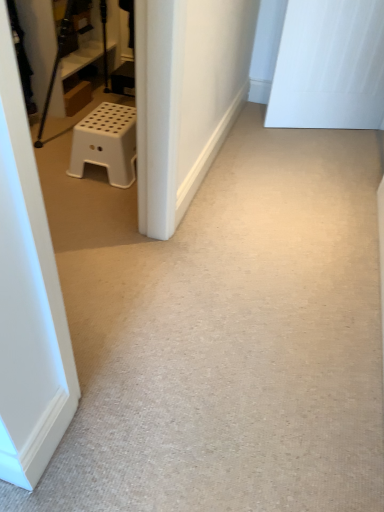
Question: Is white plastic stool at left further to camera compared to white matte door at upper right?

Choices:
 (A) yes
 (B) no

Answer: (B)

Question: Is white plastic stool at left closer to the viewer compared to white matte door at upper right?

Choices:
 (A) yes
 (B) no

Answer: (A)

Question: Considering the relative sizes of white plastic stool at left and white matte door at upper right in the image provided, is white plastic stool at left shorter than white matte door at upper right?

Choices:
 (A) no
 (B) yes

Answer: (B)

Question: Is white plastic stool at left beside white matte door at upper right?

Choices:
 (A) yes
 (B) no

Answer: (B)

Question: Does white plastic stool at left appear on the left side of white matte door at upper right?

Choices:
 (A) no
 (B) yes

Answer: (B)

Question: Is white plastic stool at left wider than white matte door at upper right?

Choices:
 (A) yes
 (B) no

Answer: (A)

Question: Is white matte door at upper right not close to white plastic stool at left?

Choices:
 (A) yes
 (B) no

Answer: (A)

Question: Is white matte door at upper right positioned beyond the bounds of white plastic stool at left?

Choices:
 (A) yes
 (B) no

Answer: (A)

Question: Does white matte door at upper right come behind white plastic stool at left?

Choices:
 (A) yes
 (B) no

Answer: (A)

Question: Is white matte door at upper right positioned with its back to white plastic stool at left?

Choices:
 (A) yes
 (B) no

Answer: (B)

Question: Considering the relative sizes of white matte door at upper right and white plastic stool at left in the image provided, is white matte door at upper right wider than white plastic stool at left?

Choices:
 (A) no
 (B) yes

Answer: (A)

Question: From the image's perspective, does white matte door at upper right appear lower than white plastic stool at left?

Choices:
 (A) no
 (B) yes

Answer: (A)

Question: Based on their sizes in the image, would you say white matte door at upper right is bigger or smaller than white plastic stool at left?

Choices:
 (A) big
 (B) small

Answer: (A)